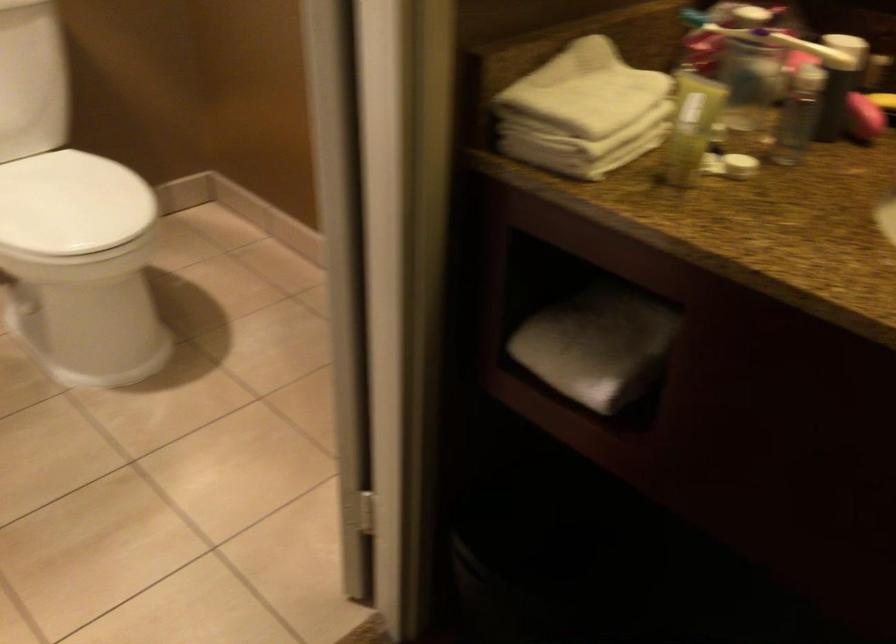
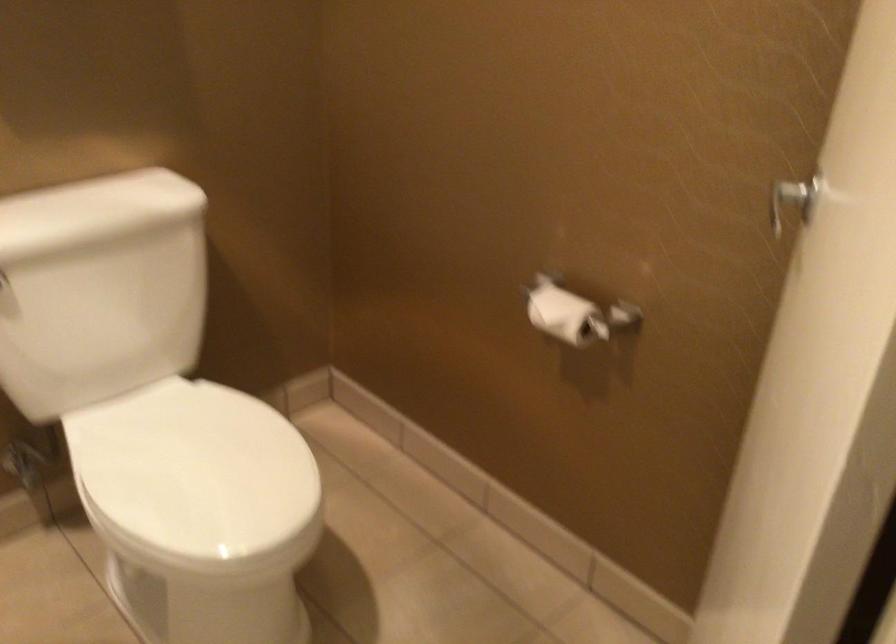
Based on the photo, what movement of the cameraman would produce the second image?

The movement direction of the cameraman is left, forward.